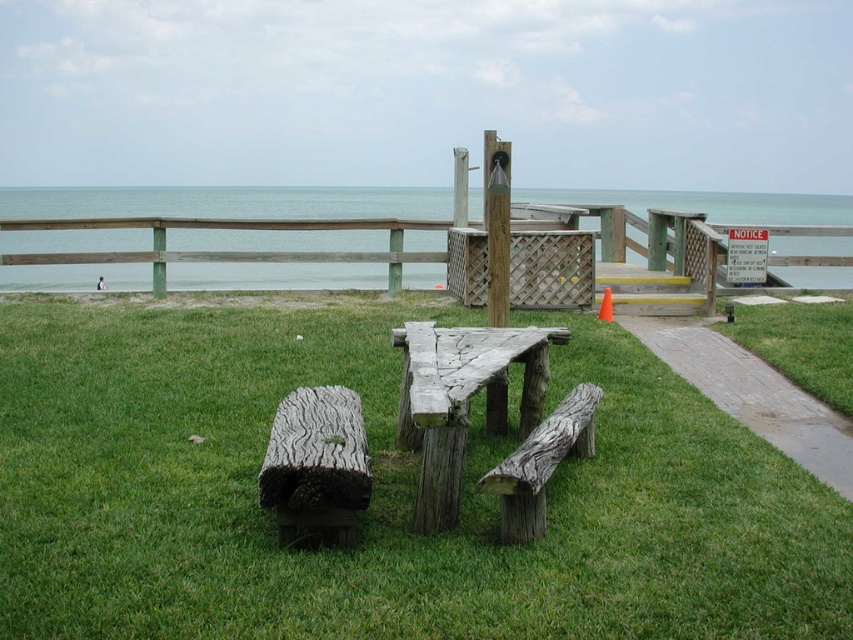
Who is lower down, green rough wood picnic table at center or weathered wood bench at lower left?

green rough wood picnic table at center

Is green rough wood picnic table at center to the right of weathered wood bench at lower left from the viewer's perspective?

Indeed, green rough wood picnic table at center is positioned on the right side of weathered wood bench at lower left.

Identify the location of green rough wood picnic table at center. (379, 492).

Where is `blue water at upper center`? blue water at upper center is located at coordinates (225, 202).

Does blue water at upper center lie in front of brick paved path at lower right?

No, blue water at upper center is further to the viewer.

This screenshot has height=640, width=853. What are the coordinates of `blue water at upper center` in the screenshot? It's located at [x=225, y=202].

Can you confirm if green rough wood picnic table at center is positioned below brick paved path at lower right?

Yes, green rough wood picnic table at center is below brick paved path at lower right.

Is green rough wood picnic table at center wider than brick paved path at lower right?

No, green rough wood picnic table at center is not wider than brick paved path at lower right.

Is point (131, 627) more distant than point (704, 356)?

No, it is not.

Locate an element on the screen. The width and height of the screenshot is (853, 640). green rough wood picnic table at center is located at coordinates (379, 492).